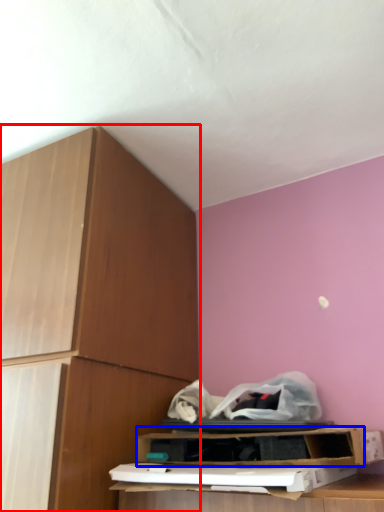
Question: Which object is closer to the camera taking this photo, cabinetry (highlighted by a red box) or shelf (highlighted by a blue box)?

Choices:
 (A) cabinetry
 (B) shelf

Answer: (A)